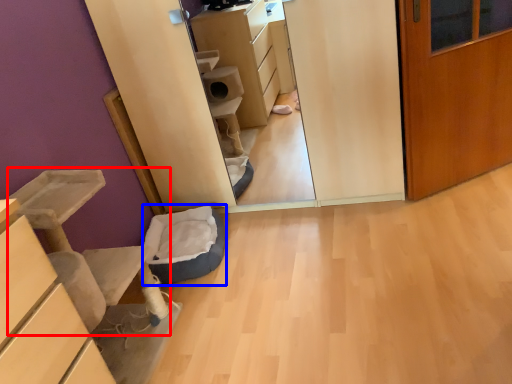
Question: Which of the following is the farthest to the observer, furniture (highlighted by a red box) or cat bed (highlighted by a blue box)?

Choices:
 (A) furniture
 (B) cat bed

Answer: (B)